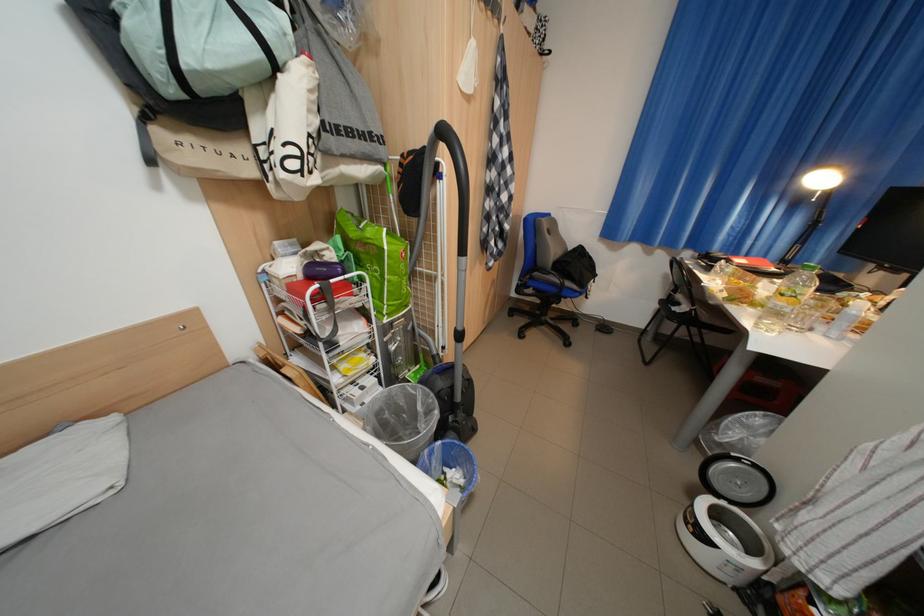
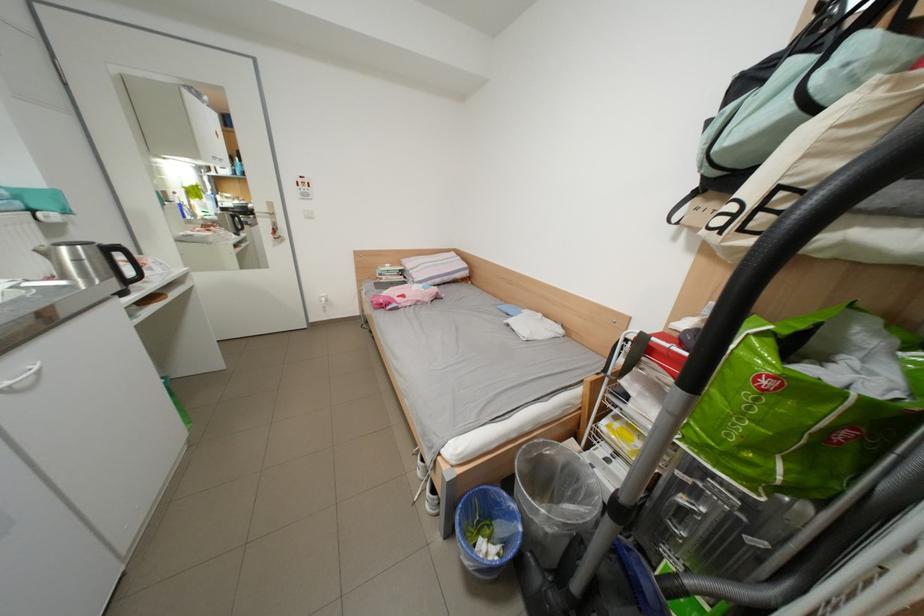
The point at (354, 177) is marked in the first image. Where is the corresponding point in the second image?

(856, 245)